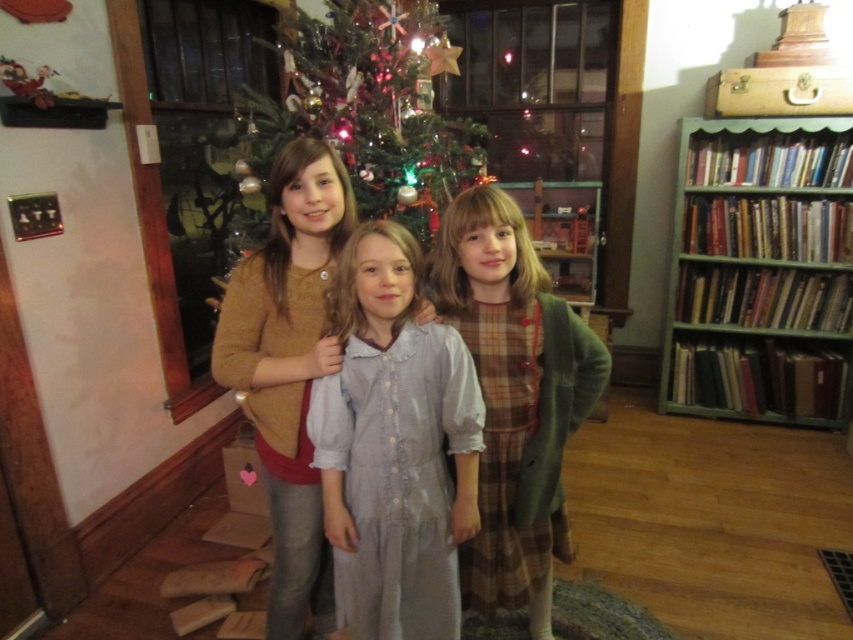
Who is shorter, matte brown cardigan at center or green textured christmas tree at center?

green textured christmas tree at center is shorter.

Which is in front, point (311, 260) or point (440, 186)?

Point (311, 260)

Locate an element on the screen. This screenshot has width=853, height=640. matte brown cardigan at center is located at coordinates (289, 368).

Does point (361, 509) come behind point (276, 349)?

No, (361, 509) is closer to viewer.

Which is more to the right, light blue cotton dress at center or matte brown cardigan at center?

From the viewer's perspective, light blue cotton dress at center appears more on the right side.

Where is `light blue cotton dress at center`? light blue cotton dress at center is located at coordinates (393, 445).

Does point (350, 612) come in front of point (517, 326)?

Yes, point (350, 612) is closer to viewer.

Is point (373, 369) positioned after point (529, 264)?

No, (373, 369) is closer to viewer.

What do you see at coordinates (393, 445) in the screenshot? I see `light blue cotton dress at center` at bounding box center [393, 445].

You are a GUI agent. You are given a task and a screenshot of the screen. Output one action in this format:
    pyautogui.click(x=<x>, y=<y>)
    Task: Click on the light blue cotton dress at center
    
    Given the screenshot: What is the action you would take?
    pyautogui.click(x=393, y=445)